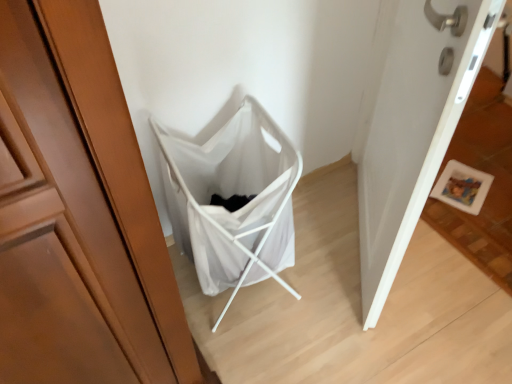
What is the approximate height of white matte door at lower right?

white matte door at lower right is 39.23 inches tall.

The width and height of the screenshot is (512, 384). What do you see at coordinates (410, 125) in the screenshot?
I see `white matte door at lower right` at bounding box center [410, 125].

You are a GUI agent. You are given a task and a screenshot of the screen. Output one action in this format:
    pyautogui.click(x=<x>, y=<y>)
    Task: Click on the white matte door at lower right
    The image size is (512, 384).
    Given the screenshot: What is the action you would take?
    pyautogui.click(x=410, y=125)

The height and width of the screenshot is (384, 512). What do you see at coordinates (230, 197) in the screenshot?
I see `white fabric laundry basket at center` at bounding box center [230, 197].

What is the approximate width of white fabric laundry basket at center?

It is 18.68 inches.

Find the location of `white fabric laundry basket at center`. white fabric laundry basket at center is located at coordinates (230, 197).

Find the location of `white matte door at lower right`. white matte door at lower right is located at coordinates (410, 125).

Considering the relative positions of white fabric laundry basket at center and white matte door at lower right in the image provided, is white fabric laundry basket at center to the right of white matte door at lower right from the viewer's perspective?

Incorrect, white fabric laundry basket at center is not on the right side of white matte door at lower right.

Is white fabric laundry basket at center closer to camera compared to white matte door at lower right?

No, white fabric laundry basket at center is further to the viewer.

Between point (239, 181) and point (421, 113), which one is positioned behind?

The point (239, 181) is farther from the camera.

From the image's perspective, which one is positioned higher, white fabric laundry basket at center or white matte door at lower right?

white matte door at lower right is shown above in the image.

From a real-world perspective, is white fabric laundry basket at center under white matte door at lower right?

Yes.

Is white fabric laundry basket at center wider than white matte door at lower right?

Yes.

Who is taller, white fabric laundry basket at center or white matte door at lower right?

With more height is white matte door at lower right.

Considering the sizes of objects white fabric laundry basket at center and white matte door at lower right in the image provided, who is smaller, white fabric laundry basket at center or white matte door at lower right?

Smaller between the two is white fabric laundry basket at center.

Which is correct: white fabric laundry basket at center is inside white matte door at lower right, or outside of it?

white fabric laundry basket at center exists outside the volume of white matte door at lower right.

Is white fabric laundry basket at center beside white matte door at lower right?

No, white fabric laundry basket at center is not in contact with white matte door at lower right.

Could you tell me if white fabric laundry basket at center is facing white matte door at lower right?

No.

In the scene shown: How different are the orientations of white fabric laundry basket at center and white matte door at lower right in degrees?

There is a 89.7-degree angle between the facing directions of white fabric laundry basket at center and white matte door at lower right.

Find the location of `door on the right of white fabric laundry basket at center`. door on the right of white fabric laundry basket at center is located at coordinates point(410,125).

Considering the positions of objects white matte door at lower right and white fabric laundry basket at center in the image provided, who is more to the left, white matte door at lower right or white fabric laundry basket at center?

Positioned to the left is white fabric laundry basket at center.

Is white matte door at lower right positioned behind white fabric laundry basket at center?

No, it is not.

Which is closer, (397, 58) or (193, 166)?

The point (397, 58) is closer.

From the image's perspective, would you say white matte door at lower right is shown under white fabric laundry basket at center?

No.

From a real-world perspective, which object stands above the other?

In real-world perspective, white matte door at lower right is above.

In terms of width, does white matte door at lower right look wider or thinner when compared to white fabric laundry basket at center?

white matte door at lower right is thinner than white fabric laundry basket at center.

Is white matte door at lower right taller or shorter than white fabric laundry basket at center?

Considering their sizes, white matte door at lower right has more height than white fabric laundry basket at center.

In the scene shown: Can you confirm if white matte door at lower right is bigger than white fabric laundry basket at center?

Correct, white matte door at lower right is larger in size than white fabric laundry basket at center.

Is white matte door at lower right inside the boundaries of white fabric laundry basket at center, or outside?

white matte door at lower right is spatially situated outside white fabric laundry basket at center.

Are white matte door at lower right and white fabric laundry basket at center beside each other?

They are not placed beside each other.

Is white fabric laundry basket at center at the back of white matte door at lower right?

No, white matte door at lower right is not facing away from white fabric laundry basket at center.

How many degrees apart are the facing directions of white matte door at lower right and white fabric laundry basket at center?

The angular difference between white matte door at lower right and white fabric laundry basket at center is 89.7 degrees.

Consider the image. How much distance is there between white matte door at lower right and white fabric laundry basket at center?

The distance of white matte door at lower right from white fabric laundry basket at center is 17.28 inches.

Image resolution: width=512 pixels, height=384 pixels. In order to click on baby carriage lying on the left of white matte door at lower right in this screenshot , I will do `click(230, 197)`.

Where is `door on the right of the white fabric laundry basket at center`? The width and height of the screenshot is (512, 384). door on the right of the white fabric laundry basket at center is located at coordinates (410, 125).

Where is `door positioned vertically above the white fabric laundry basket at center (from a real-world perspective)`? door positioned vertically above the white fabric laundry basket at center (from a real-world perspective) is located at coordinates (410, 125).